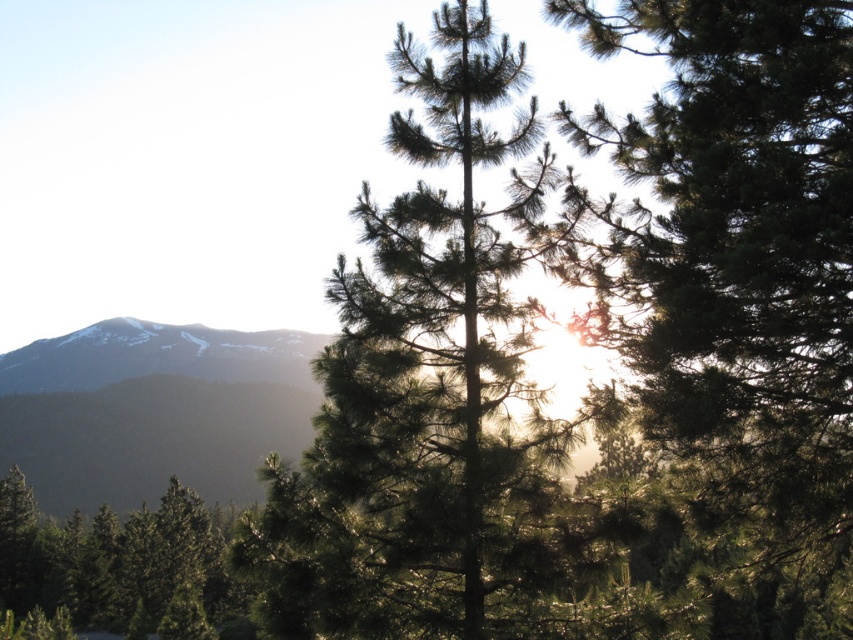
Question: Which object is closer to the camera taking this photo?

Choices:
 (A) green needle-like at center
 (B) green matte tree at lower left

Answer: (A)

Question: Observing the image, what is the correct spatial positioning of green needle-like at center in reference to smokey gray mountain at left?

Choices:
 (A) left
 (B) right

Answer: (B)

Question: Which of these objects is positioned farthest from the green needle-like at center?

Choices:
 (A) green needle-like tree at center
 (B) green matte tree at lower left

Answer: (B)

Question: Which point is closer to the camera taking this photo?

Choices:
 (A) (160, 579)
 (B) (97, 397)

Answer: (A)

Question: From the image, what is the correct spatial relationship of smokey gray mountain at left in relation to green matte tree at lower left?

Choices:
 (A) below
 (B) above

Answer: (B)

Question: Is the position of green needle-like at center more distant than that of green needle-like tree at center?

Choices:
 (A) no
 (B) yes

Answer: (B)